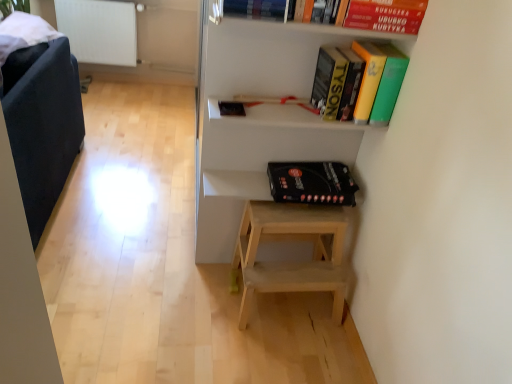
Find the location of a particular element. The height and width of the screenshot is (384, 512). black matte board game at center, arranged as the 2th paperback book when viewed from the top is located at coordinates (312, 183).

What is the approximate height of black matte board game at center, which is counted as the 2th paperback book, starting from the front?

black matte board game at center, which is counted as the 2th paperback book, starting from the front, is 3.81 inches in height.

Identify the location of dark blue fabric armchair at left. (40, 112).

Describe the element at coordinates (260, 116) in the screenshot. I see `white matte shelf at upper center` at that location.

Describe the element at coordinates (259, 9) in the screenshot. I see `hardcover book at upper center, which appears as the 2th book when viewed from the right` at that location.

The width and height of the screenshot is (512, 384). I want to click on yellow matte book at upper center, the 1th book when ordered from bottom to top, so click(x=378, y=81).

You are a GUI agent. You are given a task and a screenshot of the screen. Output one action in this format:
    pyautogui.click(x=<x>, y=<y>)
    Task: Click on the black matte board game at center, the first paperback book positioned from the back
    The height and width of the screenshot is (384, 512).
    Given the screenshot: What is the action you would take?
    pyautogui.click(x=312, y=183)

Is red matte paperback book at upper right, the 2th paperback book when ordered from bottom to top, taller or shorter than white matte shelf at upper center?

In the image, red matte paperback book at upper right, the 2th paperback book when ordered from bottom to top, appears to be shorter than white matte shelf at upper center.

Is point (362, 12) more distant than point (279, 73)?

No, it is in front of (279, 73).

Measure the distance between red matte paperback book at upper right, the 2th paperback book when ordered from bottom to top, and white matte shelf at upper center.

red matte paperback book at upper right, the 2th paperback book when ordered from bottom to top, and white matte shelf at upper center are 18.68 inches apart.

Which is more to the left, red matte paperback book at upper right, which is the second paperback book from back to front, or white matte shelf at upper center?

white matte shelf at upper center is more to the left.

From a real-world perspective, is red matte paperback book at upper right, the 1th paperback book positioned from the front, on yellow matte book at upper center, the first book from the right?

Yes, from a real-world perspective, red matte paperback book at upper right, the 1th paperback book positioned from the front, is over yellow matte book at upper center, the first book from the right

Is red matte paperback book at upper right, which is the second paperback book from back to front, turned away from yellow matte book at upper center, the first book from the right?

No, red matte paperback book at upper right, which is the second paperback book from back to front, is not facing away from yellow matte book at upper center, the first book from the right.

Is red matte paperback book at upper right, which is the second paperback book from back to front, touching yellow matte book at upper center, the first book from the right?

No, red matte paperback book at upper right, which is the second paperback book from back to front, is not beside yellow matte book at upper center, the first book from the right.

Looking at this image, considering the relative sizes of red matte paperback book at upper right, the 2th paperback book when ordered from bottom to top, and yellow matte book at upper center, the 1th book when ordered from bottom to top, in the image provided, is red matte paperback book at upper right, the 2th paperback book when ordered from bottom to top, thinner than yellow matte book at upper center, the 1th book when ordered from bottom to top,?

Indeed, red matte paperback book at upper right, the 2th paperback book when ordered from bottom to top, has a lesser width compared to yellow matte book at upper center, the 1th book when ordered from bottom to top.

Is there a large distance between black matte board game at center, the first paperback book positioned from the back, and yellow matte book at upper center, the first book from the right?

black matte board game at center, the first paperback book positioned from the back, is actually quite close to yellow matte book at upper center, the first book from the right.

Does black matte board game at center, the first paperback book positioned from the back, contain yellow matte book at upper center, which ranks as the 2th book in left-to-right order?

No.

Considering the positions of point (302, 188) and point (379, 46), is point (302, 188) closer or farther from the camera than point (379, 46)?

Point (302, 188).

Between black matte board game at center, the 1th paperback book in the bottom-to-top sequence, and yellow matte book at upper center, the 1th book when ordered from bottom to top, which one is positioned behind?

black matte board game at center, the 1th paperback book in the bottom-to-top sequence, is behind.

Does point (295, 33) appear closer or farther from the camera than point (330, 180)?

Clearly, point (295, 33) is closer to the camera than point (330, 180).

Considering the sizes of white matte shelf at upper center and black matte board game at center, the 1th paperback book in the bottom-to-top sequence, in the image, is white matte shelf at upper center wider or thinner than black matte board game at center, the 1th paperback book in the bottom-to-top sequence,?

In the image, white matte shelf at upper center appears to be more narrow than black matte board game at center, the 1th paperback book in the bottom-to-top sequence.

Is white matte shelf at upper center not inside black matte board game at center, the 1th paperback book in the bottom-to-top sequence?

Indeed, white matte shelf at upper center is completely outside black matte board game at center, the 1th paperback book in the bottom-to-top sequence.

Does black matte board game at center, the 1th paperback book in the bottom-to-top sequence, have a greater width compared to dark blue fabric armchair at left?

No, black matte board game at center, the 1th paperback book in the bottom-to-top sequence, is not wider than dark blue fabric armchair at left.

What's the angular difference between black matte board game at center, which is counted as the 2th paperback book, starting from the front, and dark blue fabric armchair at left's facing directions?

81.7 degrees.

Which of these two, black matte board game at center, arranged as the 2th paperback book when viewed from the top, or dark blue fabric armchair at left, stands taller?

dark blue fabric armchair at left is taller.

Is black matte board game at center, arranged as the 2th paperback book when viewed from the top, facing away from dark blue fabric armchair at left?

black matte board game at center, arranged as the 2th paperback book when viewed from the top, is not turned away from dark blue fabric armchair at left.

Would you say white matte shelf at upper center is inside or outside dark blue fabric armchair at left?

white matte shelf at upper center is outside dark blue fabric armchair at left.

Looking at this image, is white matte shelf at upper center oriented towards dark blue fabric armchair at left?

No, white matte shelf at upper center does not turn towards dark blue fabric armchair at left.

The height and width of the screenshot is (384, 512). Find the location of `paperback book on the right of yellow matte book at upper center, which ranks as the 2th book in left-to-right order`. paperback book on the right of yellow matte book at upper center, which ranks as the 2th book in left-to-right order is located at coordinates (386, 15).

How distant is yellow matte book at upper center, the first book from the right, from red matte paperback book at upper right, the 1th paperback book positioned from the front?

yellow matte book at upper center, the first book from the right, and red matte paperback book at upper right, the 1th paperback book positioned from the front, are 6.49 inches apart from each other.

Could red matte paperback book at upper right, the 2th paperback book when ordered from bottom to top, be considered to be inside yellow matte book at upper center, the second book in the top-to-bottom sequence?

No, red matte paperback book at upper right, the 2th paperback book when ordered from bottom to top, is not a part of yellow matte book at upper center, the second book in the top-to-bottom sequence.

Would you say yellow matte book at upper center, the first book from the right, is to the left or to the right of red matte paperback book at upper right, the 2th paperback book when ordered from bottom to top, in the picture?

yellow matte book at upper center, the first book from the right, is positioned on red matte paperback book at upper right, the 2th paperback book when ordered from bottom to top,'s left side.

Identify the location of the 1st paperback book behind the white matte shelf at upper center. Image resolution: width=512 pixels, height=384 pixels. (386, 15).

Where is `the 2nd book below the red matte paperback book at upper right, the 2th paperback book when ordered from bottom to top (from a real-world perspective)`? the 2nd book below the red matte paperback book at upper right, the 2th paperback book when ordered from bottom to top (from a real-world perspective) is located at coordinates (378, 81).

Looking at the image, which one is located closer to dark blue fabric armchair at left, yellow matte book at upper center, which ranks as the 2th book in left-to-right order, or black matte board game at center, the first paperback book positioned from the back?

The object closer to dark blue fabric armchair at left is black matte board game at center, the first paperback book positioned from the back.

Considering their positions, is red matte paperback book at upper right, the 1th paperback book positioned from the front, positioned further to hardcover book at upper center, placed as the first book when sorted from top to bottom, than white matte shelf at upper center?

The object further to hardcover book at upper center, placed as the first book when sorted from top to bottom, is white matte shelf at upper center.

From the image, which object appears to be farther from hardcover book at upper center, which ranks as the 1th book in left-to-right order, black matte board game at center, arranged as the 2th paperback book when viewed from the top, or yellow matte book at upper center, the first book from the right?

The object further to hardcover book at upper center, which ranks as the 1th book in left-to-right order, is black matte board game at center, arranged as the 2th paperback book when viewed from the top.

Estimate the real-world distances between objects in this image. Which object is closer to white matte shelf at upper center, black matte board game at center, the 1th paperback book in the bottom-to-top sequence, or dark blue fabric armchair at left?

Among the two, black matte board game at center, the 1th paperback book in the bottom-to-top sequence, is located nearer to white matte shelf at upper center.

From the image, which object appears to be nearer to dark blue fabric armchair at left, white matte shelf at upper center or hardcover book at upper center, which appears as the 2th book when viewed from the right?

white matte shelf at upper center.

When comparing their distances from white matte shelf at upper center, does red matte paperback book at upper right, the 1th paperback book positioned from the front, or dark blue fabric armchair at left seem closer?

red matte paperback book at upper right, the 1th paperback book positioned from the front.

Estimate the real-world distances between objects in this image. Which object is closer to black matte board game at center, the 1th paperback book in the bottom-to-top sequence, hardcover book at upper center, placed as the first book when sorted from top to bottom, or dark blue fabric armchair at left?

Based on the image, hardcover book at upper center, placed as the first book when sorted from top to bottom, appears to be nearer to black matte board game at center, the 1th paperback book in the bottom-to-top sequence.

When comparing their distances from red matte paperback book at upper right, the 2th paperback book when ordered from bottom to top, does black matte board game at center, the first paperback book positioned from the back, or white matte shelf at upper center seem closer?

white matte shelf at upper center lies closer to red matte paperback book at upper right, the 2th paperback book when ordered from bottom to top, than the other object.

Find the location of a particular element. This screenshot has height=384, width=512. book situated between dark blue fabric armchair at left and white matte shelf at upper center from left to right is located at coordinates (259, 9).

Where is `shelf that lies between hardcover book at upper center, acting as the 2th book starting from the bottom, and black matte board game at center, the first paperback book positioned from the back, from top to bottom`? The height and width of the screenshot is (384, 512). shelf that lies between hardcover book at upper center, acting as the 2th book starting from the bottom, and black matte board game at center, the first paperback book positioned from the back, from top to bottom is located at coordinates (260, 116).

At what (x,y) coordinates should I click in order to perform the action: click on shelf between red matte paperback book at upper right, the 1th paperback book positioned from the front, and black matte board game at center, the 1th paperback book in the bottom-to-top sequence, in the up-down direction. Please return your answer as a coordinate pair (x, y). The width and height of the screenshot is (512, 384). Looking at the image, I should click on (260, 116).

The height and width of the screenshot is (384, 512). Identify the location of book located between hardcover book at upper center, acting as the 2th book starting from the bottom, and red matte paperback book at upper right, the 2th paperback book when ordered from bottom to top, in the left-right direction. (378, 81).